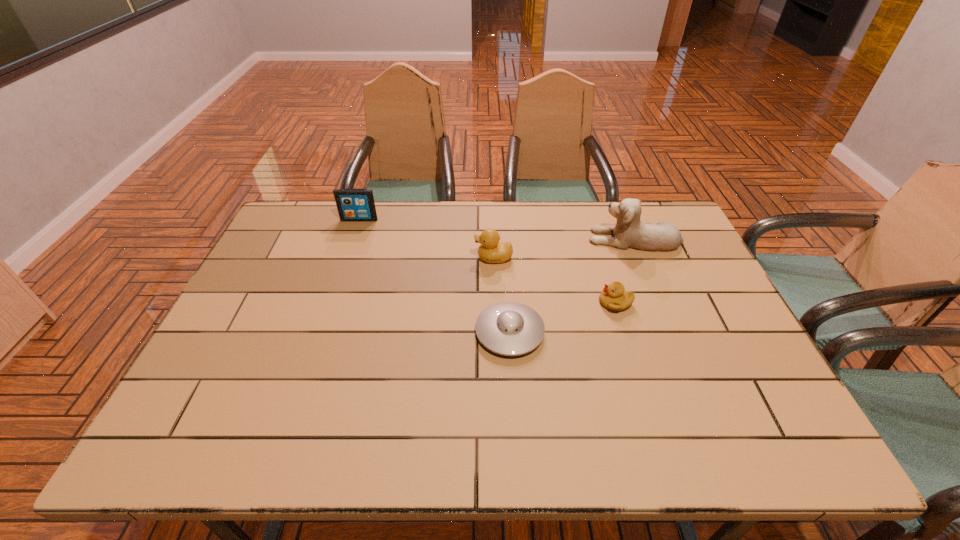
The width and height of the screenshot is (960, 540). In order to click on free space between the saucer and the farthest object in this screenshot , I will do `click(435, 276)`.

I want to click on free space between the tallest object and the leftmost object, so click(x=496, y=229).

Where is `free space between the shortest object and the taller duckling`? free space between the shortest object and the taller duckling is located at coordinates tap(502, 295).

Identify the location of free space between the taller duckling and the saucer. tap(502, 295).

This screenshot has height=540, width=960. Identify the location of free spot between the puppy and the nearer duckling. (625, 271).

In order to click on unoccupied area between the left duckling and the puppy in this screenshot , I will do `click(564, 248)`.

Identify the location of free spot between the left duckling and the second shortest object. The width and height of the screenshot is (960, 540). (555, 280).

Locate an element on the screen. free space between the farthest object and the left duckling is located at coordinates (426, 239).

Locate an element on the screen. vacant region between the tallest object and the shortest object is located at coordinates (572, 286).

Locate which object ranks in proximity to the leftmost object. Please provide its 2D coordinates. Your answer should be formatted as a tuple, i.e. [(x, y)], where the tuple contains the x and y coordinates of a point satisfying the conditions above.

[(491, 250)]